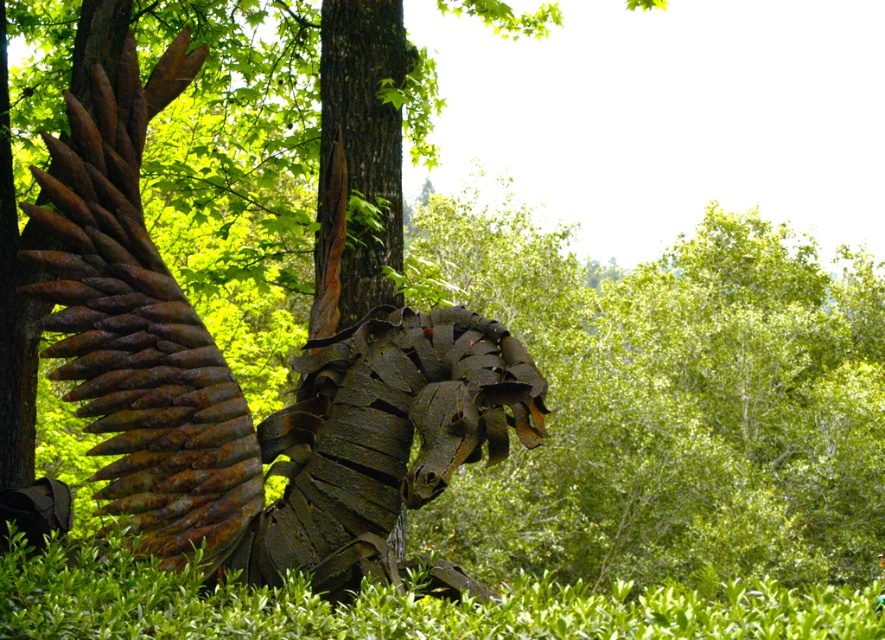
Question: Is rusty metal sculpture at center positioned in front of green leafy hedge at lower center?

Choices:
 (A) no
 (B) yes

Answer: (A)

Question: Does rusty metal sculpture at center appear under green leafy hedge at lower center?

Choices:
 (A) yes
 (B) no

Answer: (B)

Question: Which point is closer to the camera?

Choices:
 (A) (479, 353)
 (B) (198, 593)

Answer: (B)

Question: Considering the relative positions of rusty metal sculpture at center and green leafy hedge at lower center in the image provided, where is rusty metal sculpture at center located with respect to green leafy hedge at lower center?

Choices:
 (A) right
 (B) left

Answer: (B)

Question: Which object appears closest to the camera in this image?

Choices:
 (A) rusty metal sculpture at center
 (B) green leafy hedge at lower center

Answer: (B)

Question: Which point is closer to the camera?

Choices:
 (A) rusty metal sculpture at center
 (B) green leafy hedge at lower center

Answer: (B)